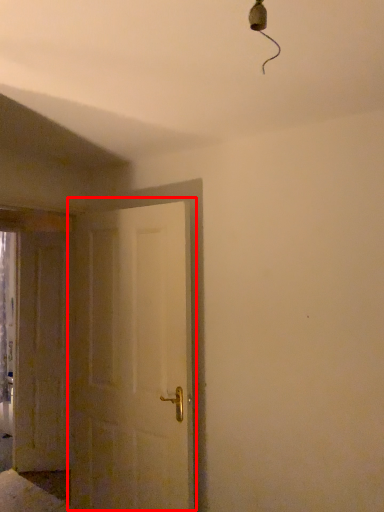
Question: From the image's perspective, what is the correct spatial positioning of door (annotated by the red box) in reference to door?

Choices:
 (A) below
 (B) above

Answer: (B)